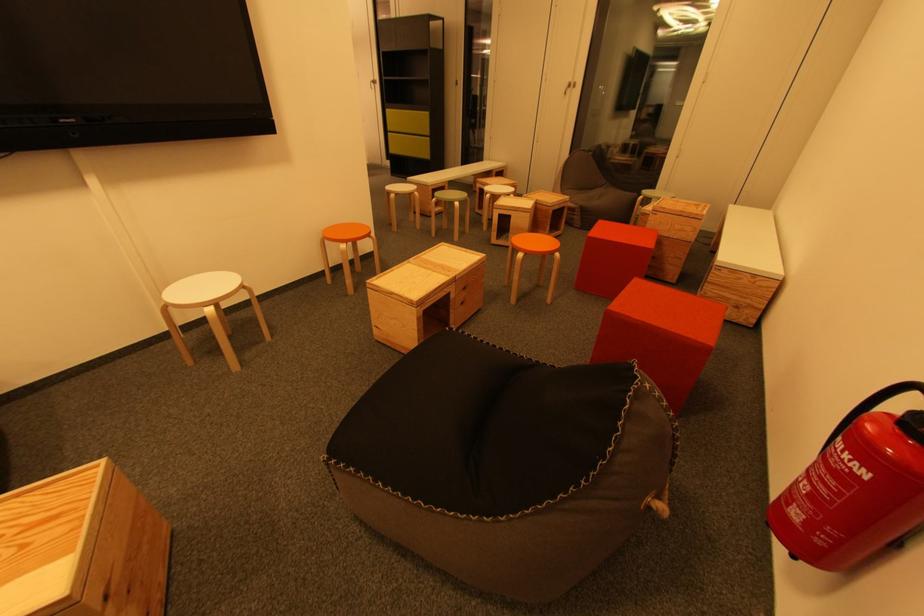
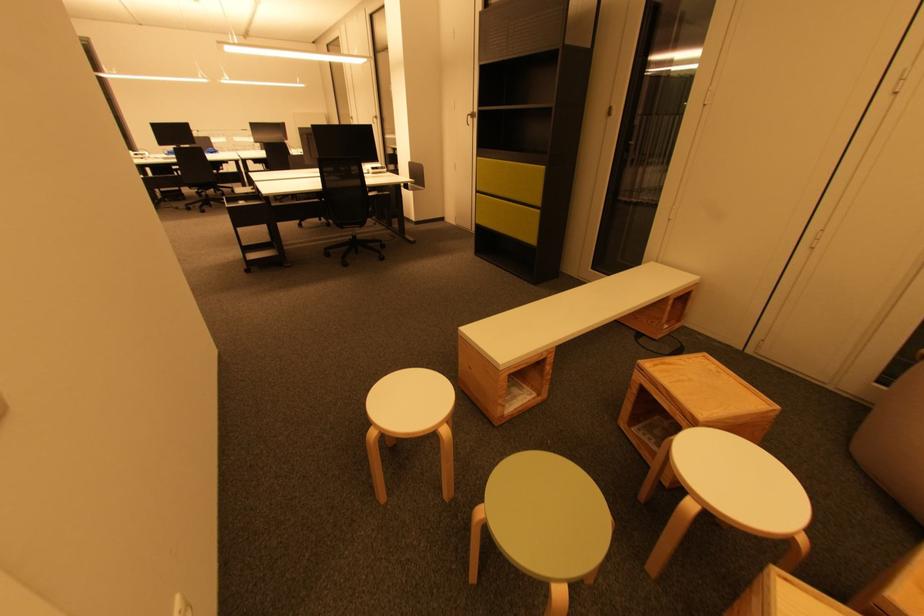
Question: What movement of the cameraman would produce the second image?

Choices:
 (A) Left
 (B) Right
 (C) Forward
 (D) Backward

Answer: (C)